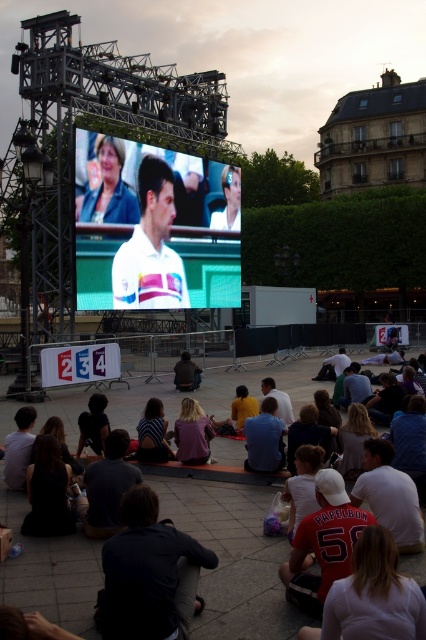
Question: Which object is closer to the camera taking this photo?

Choices:
 (A) dark blue jeans at center
 (B) striped fabric shirt at center
 (C) matte black crowd at center

Answer: (C)

Question: Which point appears closest to the camera in this image?

Choices:
 (A) (161, 410)
 (B) (199, 536)
 (C) (302, 538)

Answer: (C)

Question: Can you confirm if matte white tennis racket at center is positioned to the right of dark blue jeans at center?

Choices:
 (A) no
 (B) yes

Answer: (B)

Question: Does white glossy tennis player at center appear on the left side of matte white tennis racket at center?

Choices:
 (A) yes
 (B) no

Answer: (A)

Question: Based on their relative distances, which object is farther from the blonde hair at center?

Choices:
 (A) matte white tennis racket at center
 (B) matte blue jacket at upper left

Answer: (A)

Question: Can you confirm if matte black crowd at center is positioned to the right of matte white shirt at center?

Choices:
 (A) no
 (B) yes

Answer: (B)